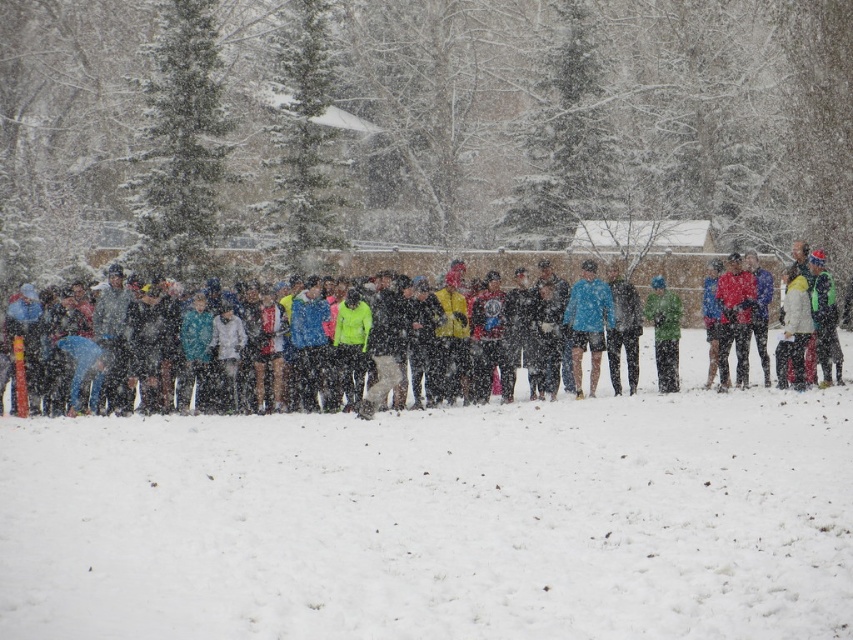
Question: Is white fluffy snow at lower center behind multicolored jackets at center?

Choices:
 (A) yes
 (B) no

Answer: (B)

Question: Which of the following is the farthest from the observer?

Choices:
 (A) (728, 376)
 (B) (421, 252)
 (C) (27, 608)

Answer: (B)

Question: Among these points, which one is farthest from the camera?

Choices:
 (A) (668, 349)
 (B) (576, 381)
 (C) (672, 264)
 (D) (521, 630)

Answer: (C)

Question: From the image, what is the correct spatial relationship of white fluffy snow at lower center in relation to green fabric jacket at center?

Choices:
 (A) left
 (B) right

Answer: (A)

Question: Among these points, which one is nearest to the camera?

Choices:
 (A) (151, 524)
 (B) (573, 304)
 (C) (511, 282)

Answer: (A)

Question: Does matte red jacket at right have a smaller size compared to green fabric jacket at center?

Choices:
 (A) yes
 (B) no

Answer: (B)